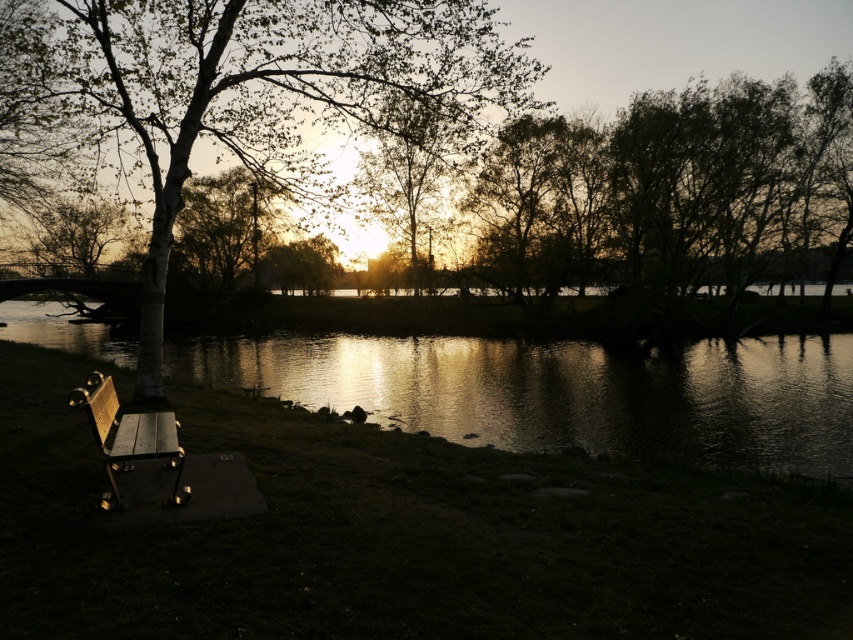
Question: Which of the following is the closest to the observer?

Choices:
 (A) (144, 378)
 (B) (44, 252)
 (C) (421, 147)

Answer: (A)

Question: Can you confirm if glistening water at center is positioned to the right of wooden bench at lower left?

Choices:
 (A) yes
 (B) no

Answer: (B)

Question: Among these points, which one is nearest to the camera?

Choices:
 (A) (802, 468)
 (B) (173, 467)
 (C) (196, 88)
 (D) (105, 216)

Answer: (B)

Question: Does glistening water at center appear on the right side of smooth bark tree at upper left?

Choices:
 (A) no
 (B) yes

Answer: (B)

Question: Estimate the real-world distances between objects in this image. Which object is closer to the glistening water at center?

Choices:
 (A) wooden bench at lower left
 (B) smooth bark tree at upper left
 (C) smooth white tree at center

Answer: (C)

Question: From the image, what is the correct spatial relationship of glistening water at center in relation to smooth bark tree at upper left?

Choices:
 (A) below
 (B) above

Answer: (A)